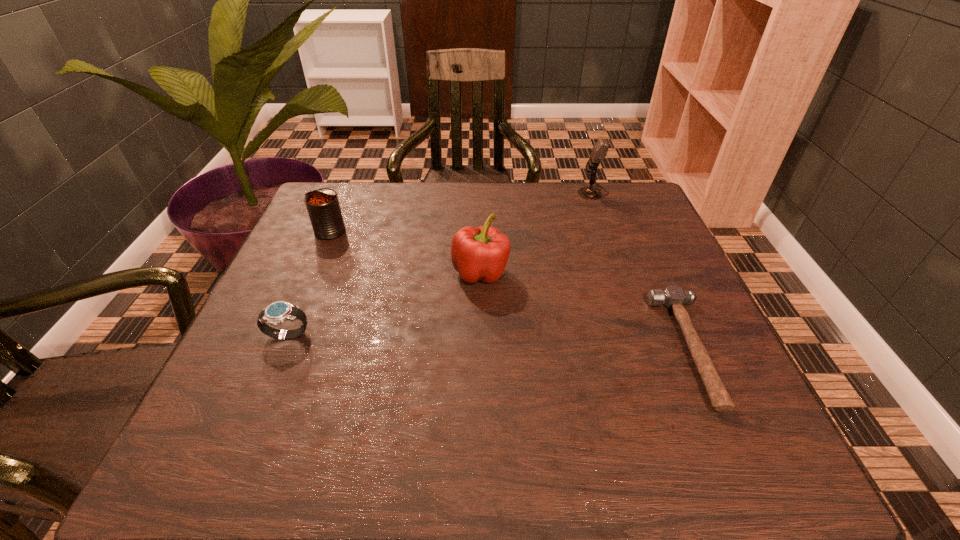
Identify the location of the closest object to the third object from right to left. This screenshot has width=960, height=540. (323, 207).

Identify the location of vacant space that satisfies the following two spatial constraints: 1. on the front side of the second shortest object; 2. on the right side of the second farthest object. This screenshot has width=960, height=540. (285, 336).